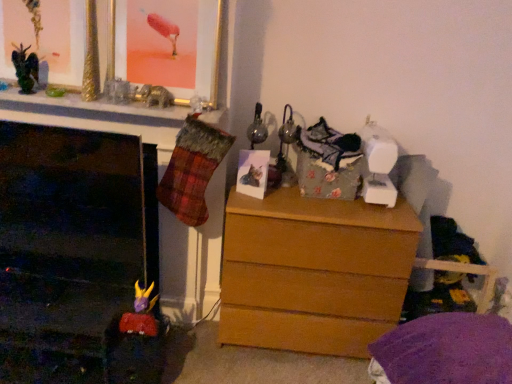
Question: Is gold metallic picture frame at upper center, placed as the second picture frame when sorted from bottom to top, positioned in front of light brown wood chest of drawers at center?

Choices:
 (A) yes
 (B) no

Answer: (A)

Question: Is gold metallic picture frame at upper center, placed as the second picture frame when sorted from bottom to top, aimed at light brown wood chest of drawers at center?

Choices:
 (A) no
 (B) yes

Answer: (A)

Question: From a real-world perspective, is gold metallic picture frame at upper center, arranged as the first picture frame when viewed from the left, positioned over light brown wood chest of drawers at center based on gravity?

Choices:
 (A) no
 (B) yes

Answer: (B)

Question: Is gold metallic picture frame at upper center, arranged as the first picture frame when viewed from the left, at the left side of light brown wood chest of drawers at center?

Choices:
 (A) no
 (B) yes

Answer: (B)

Question: From the image's perspective, is gold metallic picture frame at upper center, the 2th picture frame viewed from the right, under light brown wood chest of drawers at center?

Choices:
 (A) yes
 (B) no

Answer: (B)

Question: Can you confirm if gold metallic picture frame at upper center, placed as the second picture frame when sorted from bottom to top, is taller than light brown wood chest of drawers at center?

Choices:
 (A) yes
 (B) no

Answer: (B)

Question: From a real-world perspective, is gold metallic picture frame at upper center, marked as the first picture frame in a top-to-bottom arrangement, positioned over matte paper photo at center, which is the 2th picture frame in left-to-right order, based on gravity?

Choices:
 (A) yes
 (B) no

Answer: (A)

Question: Can you see gold metallic picture frame at upper center, the 2th picture frame viewed from the right, touching matte paper photo at center, which is the 1th picture frame from bottom to top?

Choices:
 (A) no
 (B) yes

Answer: (A)

Question: Considering the relative sizes of gold metallic picture frame at upper center, the 2th picture frame viewed from the right, and matte paper photo at center, which is the 2th picture frame in left-to-right order, in the image provided, is gold metallic picture frame at upper center, the 2th picture frame viewed from the right, bigger than matte paper photo at center, which is the 2th picture frame in left-to-right order,?

Choices:
 (A) no
 (B) yes

Answer: (B)

Question: Is gold metallic picture frame at upper center, arranged as the first picture frame when viewed from the left, aimed at matte paper photo at center, the 1th picture frame in the right-to-left sequence?

Choices:
 (A) no
 (B) yes

Answer: (A)

Question: Does gold metallic picture frame at upper center, marked as the first picture frame in a top-to-bottom arrangement, come behind matte paper photo at center, which is the 1th picture frame from bottom to top?

Choices:
 (A) no
 (B) yes

Answer: (A)

Question: From a real-world perspective, is gold metallic picture frame at upper center, placed as the second picture frame when sorted from bottom to top, under matte paper photo at center, the 2th picture frame viewed from the top?

Choices:
 (A) no
 (B) yes

Answer: (A)

Question: Considering the relative positions of matte paper photo at center, which is the 1th picture frame from bottom to top, and metallic black dragon at upper left in the image provided, is matte paper photo at center, which is the 1th picture frame from bottom to top, to the right of metallic black dragon at upper left from the viewer's perspective?

Choices:
 (A) no
 (B) yes

Answer: (B)